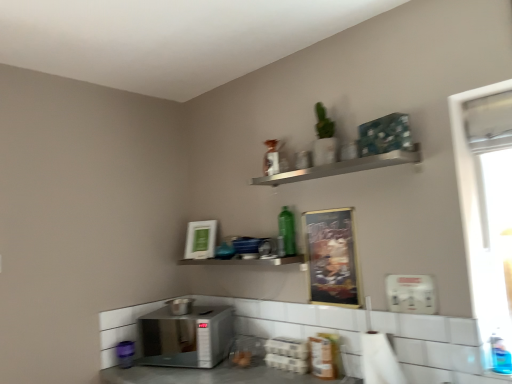
Question: Is metallic gold bulletin board at center wider or thinner than metallic silver shelf at center, the 1th shelf ordered from the bottom?

Choices:
 (A) thin
 (B) wide

Answer: (A)

Question: Considering their positions, is metallic gold bulletin board at center located in front of or behind metallic silver shelf at center, the 2th shelf when ordered from top to bottom?

Choices:
 (A) front
 (B) behind

Answer: (A)

Question: Which object is the closest to the satin silver microwave at lower center, marked as the third appliance in a top-to-bottom arrangement?

Choices:
 (A) white plastic dispenser at lower right, the 3th appliance viewed from the left
 (B) green glass bottle at center, which is the 2th bottle in front-to-back order
 (C) green matte picture frame at upper center
 (D) satin silver toaster at lower left, the 1th appliance in the left-to-right sequence
 (E) blue plastic bottle at lower right, which appears as the 1th bottle when ordered from the bottom

Answer: (D)

Question: Which object is positioned closest to the white plastic dispenser at lower right, the 3th appliance viewed from the left?

Choices:
 (A) white plastic window screen at right
 (B) satin silver microwave at lower center, marked as the 1th appliance in a bottom-to-top arrangement
 (C) silver metallic shelf at upper center, the 1th shelf from the top
 (D) blue plastic bottle at lower right, the second bottle in the back-to-front sequence
 (E) metallic gold bulletin board at center

Answer: (E)